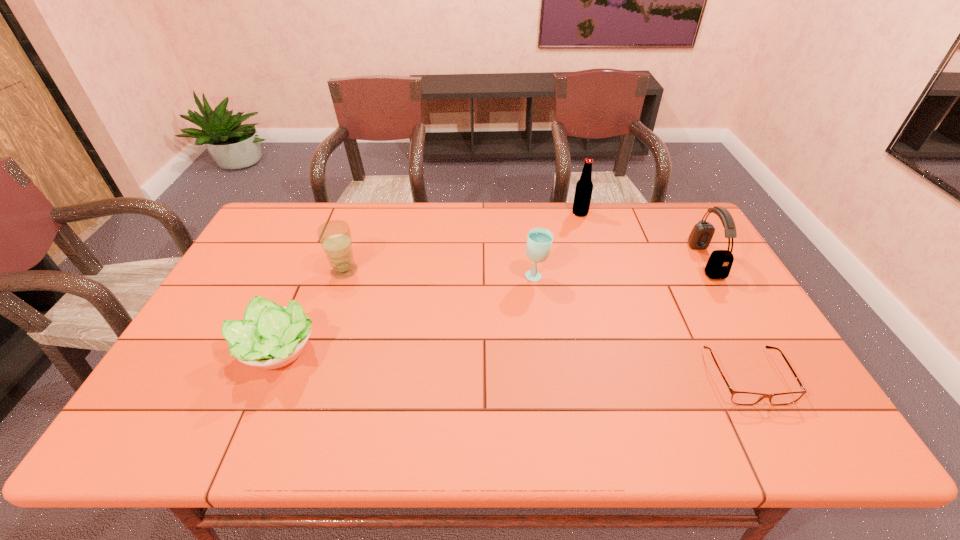
Find the location of `object that is at the far right corner`. object that is at the far right corner is located at coordinates (719, 264).

Find the location of a particular element. The height and width of the screenshot is (540, 960). vacant point at the far edge is located at coordinates (520, 221).

In the image, there is a desktop. Identify the location of vacant space at the near edge. This screenshot has width=960, height=540. 728,440.

In the image, there is a desktop. Where is `vacant area at the right edge`? The width and height of the screenshot is (960, 540). vacant area at the right edge is located at coordinates (706, 259).

Where is `free space between the left glass and the beer bottle`? free space between the left glass and the beer bottle is located at coordinates (462, 242).

Find the location of a particular element. The width and height of the screenshot is (960, 540). unoccupied position between the headset and the third object from right to left is located at coordinates (642, 237).

At what (x,y) coordinates should I click in order to perform the action: click on empty space between the fifth tallest object and the headset. Please return your answer as a coordinate pair (x, y). The height and width of the screenshot is (540, 960). Looking at the image, I should click on [491, 306].

The image size is (960, 540). What are the coordinates of `free space between the spectacles and the third object from right to left` in the screenshot? It's located at (663, 295).

The width and height of the screenshot is (960, 540). I want to click on unoccupied position between the farthest object and the left glass, so click(x=462, y=242).

At what (x,y) coordinates should I click in order to perform the action: click on blank region between the right glass and the spectacles. Please return your answer as a coordinate pair (x, y). The width and height of the screenshot is (960, 540). Looking at the image, I should click on (641, 327).